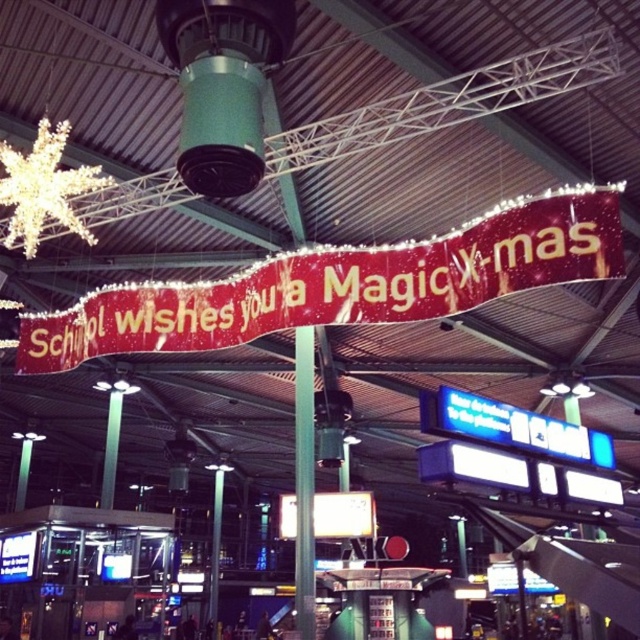
You are a traveler standing in the terminal and want to take a photo of both the shiny red banner at center and the green metallic pole at center. Which object will appear larger in your photo?

The shiny red banner at center will appear larger in your photo because it is taller than the green metallic pole at center.

You are a traveler standing in the terminal and want to take a photo of the shiny red banner at center and the green metallic pole at center. Which object should you focus on first to ensure both are in the frame?

You should focus on the shiny red banner at center first since it is closer to you than the green metallic pole at center, allowing both to be in the frame by adjusting the camera angle.